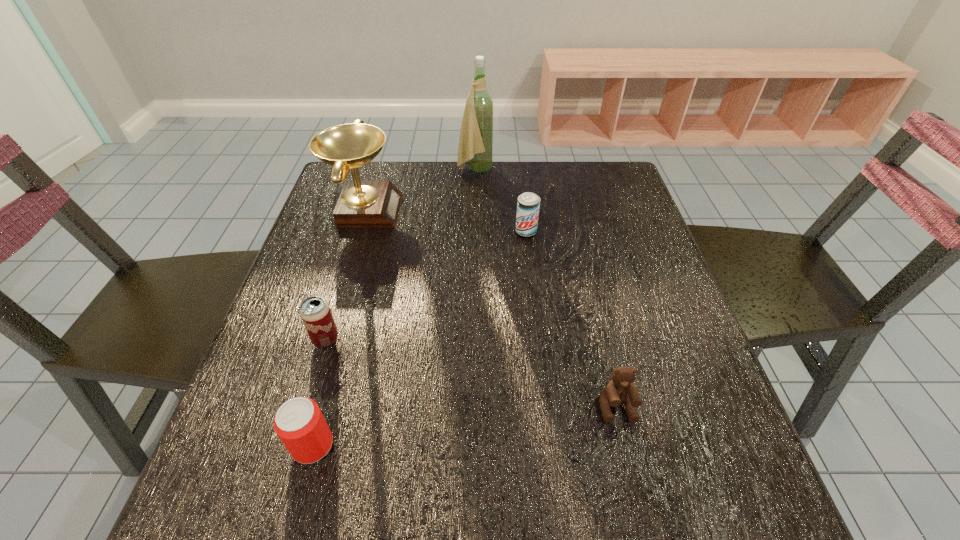
Find the location of `free space that satisfies the following two spatial constraints: 1. on the back side of the farthest beer can; 2. on the front-facing side of the tallest object`. free space that satisfies the following two spatial constraints: 1. on the back side of the farthest beer can; 2. on the front-facing side of the tallest object is located at coordinates (518, 170).